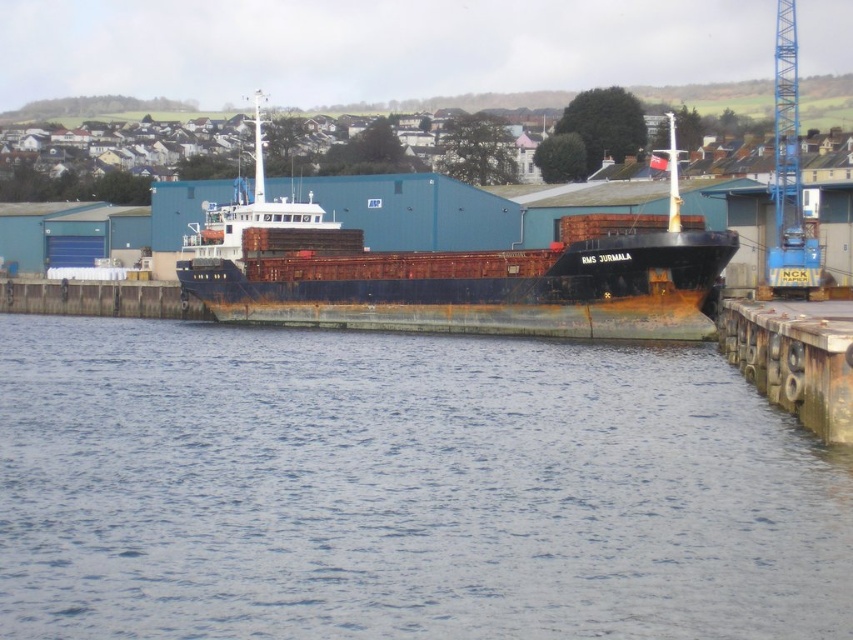
Can you confirm if rusty metal ship at center is positioned below blue metallic crane at upper right?

Yes, rusty metal ship at center is below blue metallic crane at upper right.

Is rusty metal ship at center to the right of blue metallic crane at upper right from the viewer's perspective?

Incorrect, rusty metal ship at center is not on the right side of blue metallic crane at upper right.

Who is more forward, (672, 161) or (785, 225)?

Point (672, 161) is in front.

The height and width of the screenshot is (640, 853). In order to click on rusty metal ship at center in this screenshot , I will do `click(456, 273)`.

Is point (271, 544) farther from viewer compared to point (776, 60)?

No, it is in front of (776, 60).

This screenshot has height=640, width=853. What do you see at coordinates (402, 490) in the screenshot?
I see `blue water at lower center` at bounding box center [402, 490].

Find the location of a particular element. blue water at lower center is located at coordinates (402, 490).

Does blue water at lower center appear over rusty metal ship at center?

Incorrect, blue water at lower center is not positioned above rusty metal ship at center.

Is blue water at lower center below rusty metal ship at center?

Indeed, blue water at lower center is positioned under rusty metal ship at center.

Between point (57, 557) and point (418, 262), which one is positioned behind?

The point (418, 262) is behind.

At what (x,y) coordinates should I click in order to perform the action: click on blue water at lower center. Please return your answer as a coordinate pair (x, y). This screenshot has height=640, width=853. Looking at the image, I should click on (402, 490).